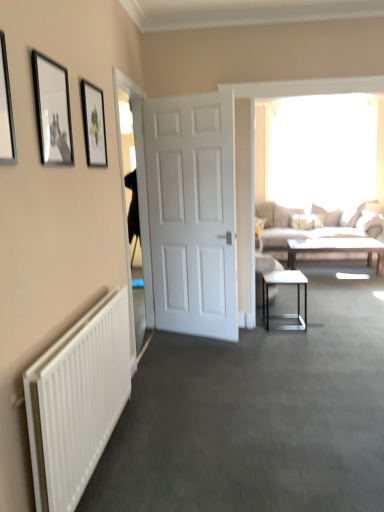
This screenshot has height=512, width=384. What are the coordinates of `transparent glass window at upper center` in the screenshot? It's located at (323, 150).

At what (x,y) coordinates should I click in order to perform the action: click on metallic silver picture frame at upper left, the 3th picture frame viewed from the right. Please return your answer as a coordinate pair (x, y). The image size is (384, 512). Looking at the image, I should click on (x=6, y=111).

The width and height of the screenshot is (384, 512). What do you see at coordinates (6, 111) in the screenshot?
I see `metallic silver picture frame at upper left, the third picture frame positioned from the back` at bounding box center [6, 111].

In order to face matte black picture frame at upper left, placed as the third picture frame when sorted from front to back, should I rotate leftwards or rightwards?

To face it directly, rotate left by 12.680 degrees.

This screenshot has width=384, height=512. In order to click on metallic black side table at center in this screenshot , I will do `click(297, 298)`.

Is point (7, 90) behind point (310, 130)?

No, it is not.

Who is shorter, metallic silver picture frame at upper left, the first picture frame in the front-to-back sequence, or transparent glass window at upper center?

Standing shorter between the two is metallic silver picture frame at upper left, the first picture frame in the front-to-back sequence.

Is metallic silver picture frame at upper left, the third picture frame positioned from the back, in front of transparent glass window at upper center?

Yes, the depth of metallic silver picture frame at upper left, the third picture frame positioned from the back, is less than that of transparent glass window at upper center.

Who is bigger, metallic silver picture frame at upper left, the 3th picture frame viewed from the right, or transparent glass window at upper center?

transparent glass window at upper center.

From the picture: Is matte black picture frame at upper left, placed as the third picture frame when sorted from front to back, completely or partially outside of light brown wooden coffee table at center?

Absolutely, matte black picture frame at upper left, placed as the third picture frame when sorted from front to back, is external to light brown wooden coffee table at center.

How far apart are matte black picture frame at upper left, placed as the third picture frame when sorted from front to back, and light brown wooden coffee table at center?

They are 13.99 feet apart.

From a real-world perspective, is matte black picture frame at upper left, placed as the third picture frame when sorted from front to back, located beneath light brown wooden coffee table at center?

No, from a real-world perspective, matte black picture frame at upper left, placed as the third picture frame when sorted from front to back, is not under light brown wooden coffee table at center.

Between matte black picture frame at upper left, which ranks as the 1th picture frame in right-to-left order, and light brown wooden coffee table at center, which one appears on the right side from the viewer's perspective?

light brown wooden coffee table at center.

Is white matte door at center located within matte black picture frame at upper left, which ranks as the 1th picture frame in right-to-left order?

That's incorrect, white matte door at center is not inside matte black picture frame at upper left, which ranks as the 1th picture frame in right-to-left order.

Which is in front, matte black picture frame at upper left, the 1th picture frame from the back, or white matte door at center?

Positioned in front is matte black picture frame at upper left, the 1th picture frame from the back.

From a real-world perspective, is matte black picture frame at upper left, the 1th picture frame from the back, physically located above or below white matte door at center?

Clearly, from a real-world perspective, matte black picture frame at upper left, the 1th picture frame from the back, is above white matte door at center.

Considering the positions of point (102, 152) and point (153, 100), is point (102, 152) closer or farther from the camera than point (153, 100)?

Point (102, 152).

Can you confirm if matte black picture frame at upper left, positioned as the 3th picture frame in left-to-right order, is positioned to the right of metallic silver picture frame at upper left, which ranks as the 1th picture frame in left-to-right order?

Yes.

From a real-world perspective, is matte black picture frame at upper left, the 1th picture frame from the back, physically below metallic silver picture frame at upper left, the first picture frame in the front-to-back sequence?

No, from a real-world perspective, matte black picture frame at upper left, the 1th picture frame from the back, is not under metallic silver picture frame at upper left, the first picture frame in the front-to-back sequence.

Is matte black picture frame at upper left, positioned as the 3th picture frame in left-to-right order, completely or partially outside of metallic silver picture frame at upper left, the first picture frame in the front-to-back sequence?

Yes, matte black picture frame at upper left, positioned as the 3th picture frame in left-to-right order, is not within metallic silver picture frame at upper left, the first picture frame in the front-to-back sequence.

Locate an element on the screen. The image size is (384, 512). picture frame that is the 2nd one when counting backward from the metallic silver picture frame at upper left, the first picture frame in the front-to-back sequence is located at coordinates (94, 124).

Would you say transparent glass window at upper center is inside or outside matte black picture frame at upper left, placed as the third picture frame when sorted from front to back?

transparent glass window at upper center is located beyond the bounds of matte black picture frame at upper left, placed as the third picture frame when sorted from front to back.

Between transparent glass window at upper center and matte black picture frame at upper left, which ranks as the 1th picture frame in right-to-left order, which one has larger size?

Bigger between the two is transparent glass window at upper center.

Is transparent glass window at upper center touching matte black picture frame at upper left, which ranks as the 1th picture frame in right-to-left order?

There is a gap between transparent glass window at upper center and matte black picture frame at upper left, which ranks as the 1th picture frame in right-to-left order.

From a real-world perspective, which object rests below the other?

In real-world perspective, white ribbed radiator at lower left is lower.

Is beige fabric couch at right oriented towards white ribbed radiator at lower left?

Yes.

Is beige fabric couch at right wider or thinner than white ribbed radiator at lower left?

In the image, beige fabric couch at right appears to be wider than white ribbed radiator at lower left.

From the image's perspective, would you say beige fabric couch at right is positioned over white ribbed radiator at lower left?

Yes, from the image's perspective, beige fabric couch at right is on top of white ribbed radiator at lower left.

Considering the relative positions of black matte picture frame at upper left, marked as the second picture frame in a right-to-left arrangement, and transparent glass door at left in the image provided, is black matte picture frame at upper left, marked as the second picture frame in a right-to-left arrangement, to the left or to the right of transparent glass door at left?

Clearly, black matte picture frame at upper left, marked as the second picture frame in a right-to-left arrangement, is on the left of transparent glass door at left in the image.

Is black matte picture frame at upper left, which is the 2th picture frame in front-to-back order, bigger or smaller than transparent glass door at left?

Clearly, black matte picture frame at upper left, which is the 2th picture frame in front-to-back order, is smaller in size than transparent glass door at left.

From the image's perspective, which picture frame is the 3rd one below the transparent glass window at upper center? Please provide its 2D coordinates.

[(6, 111)]

You are a GUI agent. You are given a task and a screenshot of the screen. Output one action in this format:
    pyautogui.click(x=<x>, y=<y>)
    Task: Click on the 3rd picture frame above when counting from the light brown wooden coffee table at center (from the image's perspective)
    The height and width of the screenshot is (512, 384).
    Given the screenshot: What is the action you would take?
    pyautogui.click(x=94, y=124)

Based on their spatial positions, is metallic black side table at center or beige fabric couch at right further from white ribbed radiator at lower left?

Among the two, beige fabric couch at right is located further to white ribbed radiator at lower left.

When comparing their distances from metallic black side table at center, does white ribbed radiator at lower left or black matte picture frame at upper left, placed as the 2th picture frame when sorted from left to right, seem further?

Based on the image, black matte picture frame at upper left, placed as the 2th picture frame when sorted from left to right, appears to be further to metallic black side table at center.

Estimate the real-world distances between objects in this image. Which object is further from white ribbed radiator at lower left, beige fabric couch at right or metallic black side table at center?

beige fabric couch at right is positioned further to the anchor white ribbed radiator at lower left.

Which object lies nearer to the anchor point light brown wooden coffee table at center, white ribbed radiator at lower left or black matte picture frame at upper left, which is the 2th picture frame in front-to-back order?

Among the two, white ribbed radiator at lower left is located nearer to light brown wooden coffee table at center.

From the image, which object appears to be farther from beige fabric couch at right, matte black picture frame at upper left, which ranks as the 1th picture frame in right-to-left order, or transparent glass door at left?

matte black picture frame at upper left, which ranks as the 1th picture frame in right-to-left order, is positioned further to the anchor beige fabric couch at right.

When comparing their distances from matte black picture frame at upper left, placed as the third picture frame when sorted from front to back, does transparent glass door at left or light brown wooden coffee table at center seem closer?

transparent glass door at left.

When comparing their distances from transparent glass window at upper center, does metallic black side table at center or beige fabric couch at right seem closer?

The object closer to transparent glass window at upper center is beige fabric couch at right.

Looking at the image, which one is located closer to white matte door at center, light brown wooden coffee table at center or metallic black side table at center?

→ metallic black side table at center lies closer to white matte door at center than the other object.

The height and width of the screenshot is (512, 384). I want to click on studio couch between metallic silver picture frame at upper left, the third picture frame positioned from the back, and light brown wooden coffee table at center, along the z-axis, so tap(311, 229).

At what (x,y) coordinates should I click in order to perform the action: click on coffee table positioned between metallic silver picture frame at upper left, the first picture frame in the front-to-back sequence, and transparent glass window at upper center from near to far. Please return your answer as a coordinate pair (x, y). The image size is (384, 512). Looking at the image, I should click on (336, 248).

Where is `door situated between transparent glass door at left and metallic black side table at center from left to right`? Image resolution: width=384 pixels, height=512 pixels. door situated between transparent glass door at left and metallic black side table at center from left to right is located at coordinates (191, 213).

Locate an element on the screen. table between matte black picture frame at upper left, which ranks as the 1th picture frame in right-to-left order, and light brown wooden coffee table at center in the front-back direction is located at coordinates (297, 298).